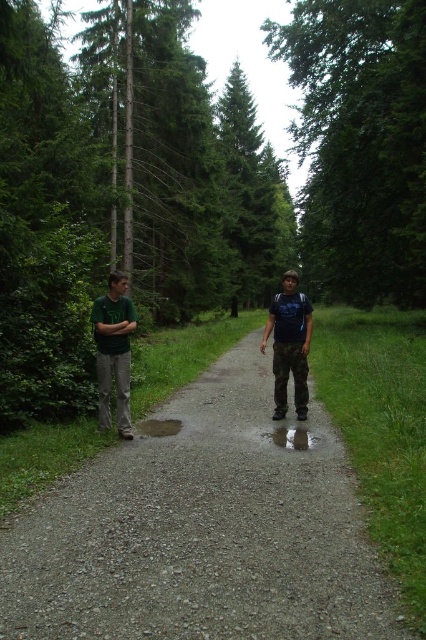
Question: Is green leafy tree at center smaller than green fabric shirt at center?

Choices:
 (A) yes
 (B) no

Answer: (B)

Question: Based on their relative distances, which object is nearer to the green matte shirt at left?

Choices:
 (A) green leafy tree at center
 (B) green fabric shirt at center
 (C) gray gravel path at center

Answer: (B)

Question: Which point is farther to the camera?

Choices:
 (A) (95, 333)
 (B) (172, 440)
 (C) (354, 285)

Answer: (C)

Question: From the image, what is the correct spatial relationship of gray gravel path at center in relation to green fabric shirt at center?

Choices:
 (A) left
 (B) right

Answer: (B)

Question: Is gray gravel path at center positioned in front of camouflage pants at center?

Choices:
 (A) yes
 (B) no

Answer: (A)

Question: Which object is farther from the camera taking this photo?

Choices:
 (A) camouflage pants at center
 (B) green fabric shirt at center
 (C) green leafy tree at center
 (D) gray gravel path at center

Answer: (C)